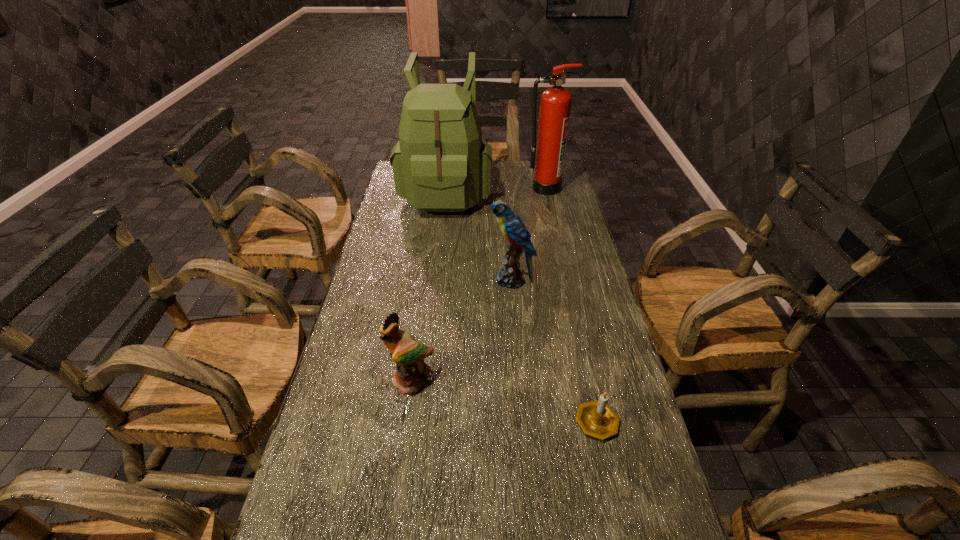
Where is `fire extinguisher`? fire extinguisher is located at coordinates (548, 158).

In order to click on backpack in this screenshot , I will do `click(440, 164)`.

The height and width of the screenshot is (540, 960). Identify the location of the farther parrot. (513, 228).

Locate an element on the screen. The width and height of the screenshot is (960, 540). the right parrot is located at coordinates (513, 228).

Locate an element on the screen. Image resolution: width=960 pixels, height=540 pixels. the second nearest object is located at coordinates (410, 373).

Identify the location of the nearer parrot. (410, 373).

Where is `the nearest object`? The height and width of the screenshot is (540, 960). the nearest object is located at coordinates (596, 418).

Find the location of a particular element. This screenshot has height=540, width=960. candle holder is located at coordinates (596, 418).

At what (x,y) coordinates should I click in order to perform the action: click on free spot located 0.350m with the nozzle pointing from the back of the fire extinguisher. Please return your answer as a coordinate pair (x, y). This screenshot has width=960, height=540. Looking at the image, I should click on (559, 246).

Where is `vacant position located on the front pocket of the backpack`? vacant position located on the front pocket of the backpack is located at coordinates (438, 264).